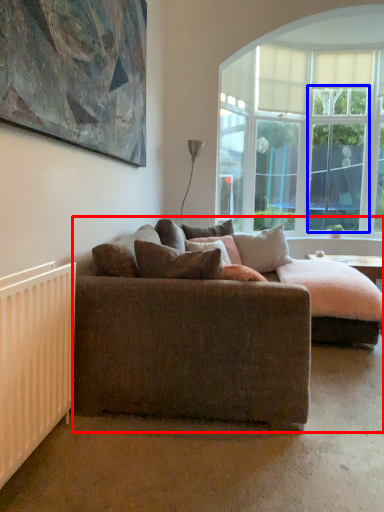
Question: Which point is further to the camera, studio couch (highlighted by a red box) or glass door (highlighted by a blue box)?

Choices:
 (A) studio couch
 (B) glass door

Answer: (B)